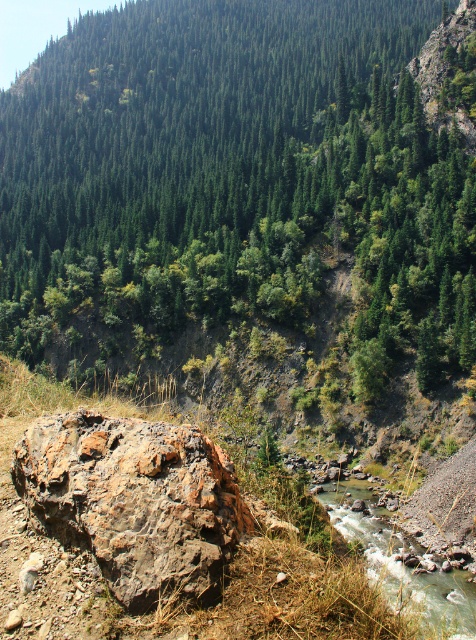
Does green matte tree at upper center have a lesser width compared to white gravelly water at lower center?

Incorrect, green matte tree at upper center's width is not less than white gravelly water at lower center's.

Is point (403, 168) positioned in front of point (427, 556)?

No, it is not.

Does point (42, 104) come closer to viewer compared to point (428, 620)?

No, (42, 104) is further to viewer.

Find the location of a particular element. The height and width of the screenshot is (640, 476). green matte tree at upper center is located at coordinates (243, 188).

Based on the photo, is green matte tree at upper center taller than rusty rock at center?

Correct, green matte tree at upper center is much taller as rusty rock at center.

Can you confirm if green matte tree at upper center is positioned below rusty rock at center?

No, green matte tree at upper center is not below rusty rock at center.

Is point (407, 157) closer to viewer compared to point (132, 554)?

That is False.

Locate an element on the screen. The image size is (476, 640). green matte tree at upper center is located at coordinates (243, 188).

How distant is rusty rock at center from white gravelly water at lower center?

23.28 feet

This screenshot has height=640, width=476. What are the coordinates of `rusty rock at center` in the screenshot? It's located at (134, 500).

What do you see at coordinates (134, 500) in the screenshot? I see `rusty rock at center` at bounding box center [134, 500].

Find the location of a particular element. The image size is (476, 640). rusty rock at center is located at coordinates (134, 500).